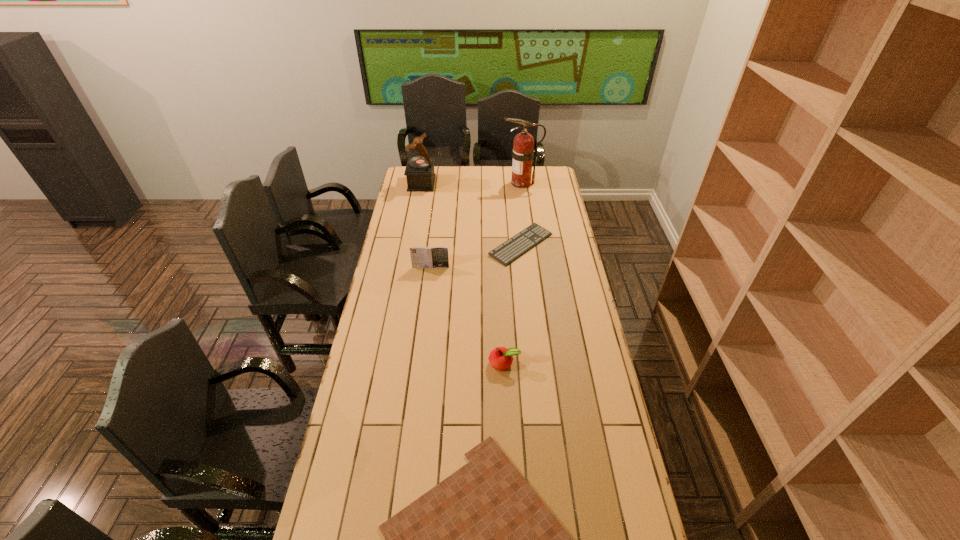
Where is `fire extinguisher`? fire extinguisher is located at coordinates (523, 152).

You are a GUI agent. You are given a task and a screenshot of the screen. Output one action in this format:
    pyautogui.click(x=<x>, y=<y>)
    Task: Click on the fifth shortest object
    
    Given the screenshot: What is the action you would take?
    pyautogui.click(x=419, y=171)

This screenshot has height=540, width=960. What are the coordinates of `book` in the screenshot? It's located at (437, 256).

What are the coordinates of `apple` in the screenshot? It's located at (500, 358).

The height and width of the screenshot is (540, 960). I want to click on the fifth farthest object, so click(x=500, y=358).

The width and height of the screenshot is (960, 540). Identify the location of the fifth tallest object. (513, 248).

You are a GUI agent. You are given a task and a screenshot of the screen. Output one action in this format:
    pyautogui.click(x=<x>, y=<y>)
    Task: Click on the vacant region located 0.300m at the nozzle of the tallest object
    The height and width of the screenshot is (540, 960).
    Given the screenshot: What is the action you would take?
    pyautogui.click(x=450, y=183)

The image size is (960, 540). I want to click on vacant region located 0.340m at the nozzle of the tallest object, so click(x=444, y=183).

Where is `vacant space located at the nozzle of the tallest object`? Image resolution: width=960 pixels, height=540 pixels. vacant space located at the nozzle of the tallest object is located at coordinates (452, 183).

At what (x,y) coordinates should I click in order to perform the action: click on vacant space located 0.140m at the horn opening of the fifth shortest object. Please return your answer as a coordinate pair (x, y). The width and height of the screenshot is (960, 540). Looking at the image, I should click on (459, 183).